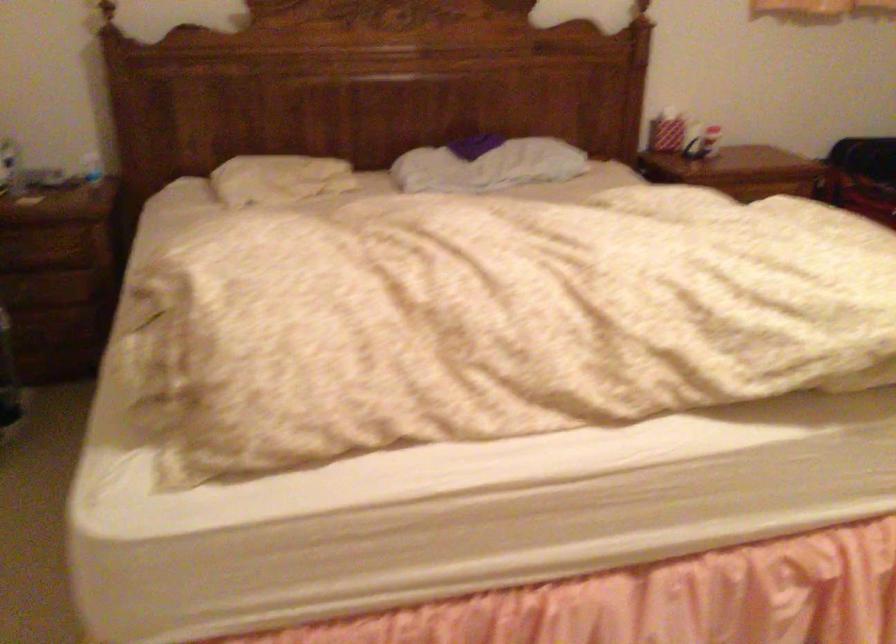
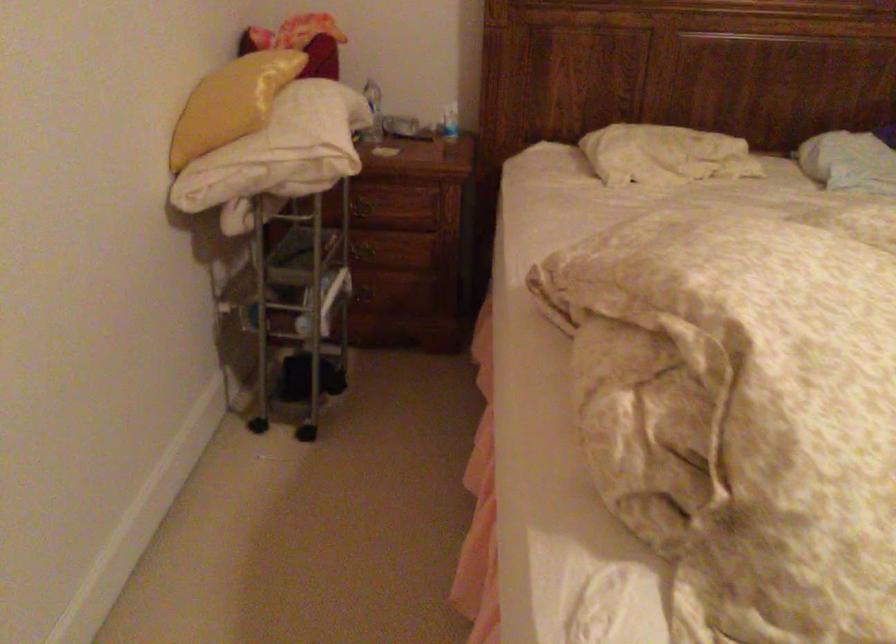
From the picture: What movement of the cameraman would produce the second image?

The movement direction of the cameraman is left, forward.